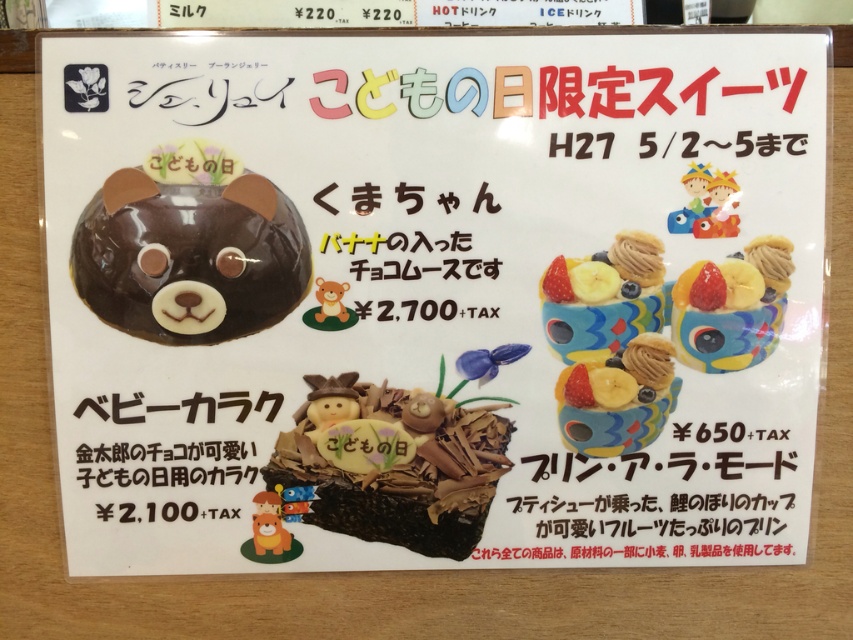
Is matte chocolate cake at center shorter than matte ceramic cupcake at upper right?

In fact, matte chocolate cake at center may be taller than matte ceramic cupcake at upper right.

Is the position of matte chocolate cake at center more distant than that of matte ceramic cupcake at upper right?

Yes, it is.

Who is more forward, (450, 531) or (778, 307)?

Point (778, 307) is more forward.

Where is `matte chocolate cake at center`? This screenshot has width=853, height=640. matte chocolate cake at center is located at coordinates (389, 465).

Which is more to the right, brownmaterial/texture at center or matte plastic toy at upper right?

From the viewer's perspective, matte plastic toy at upper right appears more on the right side.

Between brownmaterial/texture at center and matte plastic toy at upper right, which one is positioned higher?

Positioned higher is matte plastic toy at upper right.

Is point (398, 232) positioned before point (729, 182)?

No, it is not.

Identify the location of brownmaterial/texture at center. (403, 257).

Does point (491, 429) come in front of point (209, 406)?

No, (491, 429) is behind (209, 406).

Is matte chocolate cake at center in front of matte brown text at lower left?

No, matte chocolate cake at center is further to the viewer.

Is point (451, 522) farther from camera compared to point (126, 472)?

Yes, it is behind point (126, 472).

At what (x,y) coordinates should I click in order to perform the action: click on matte chocolate cake at center. Please return your answer as a coordinate pair (x, y). The image size is (853, 640). Looking at the image, I should click on (389, 465).